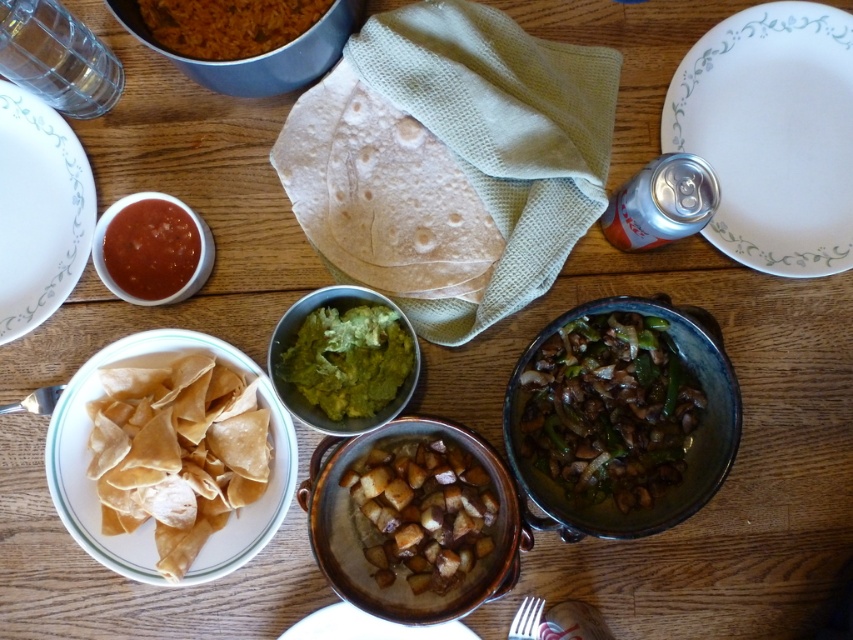
You are setting up a dinner table and need to place the brown rice at upper left onto the white ceramic plate at upper right. Can you directly pour the rice from its current position onto the plate without moving either item?

The white ceramic plate at upper right is positioned under brown rice at upper left, so yes, you can directly pour the rice from its current position onto the plate without moving either item because the plate is already located beneath the rice.